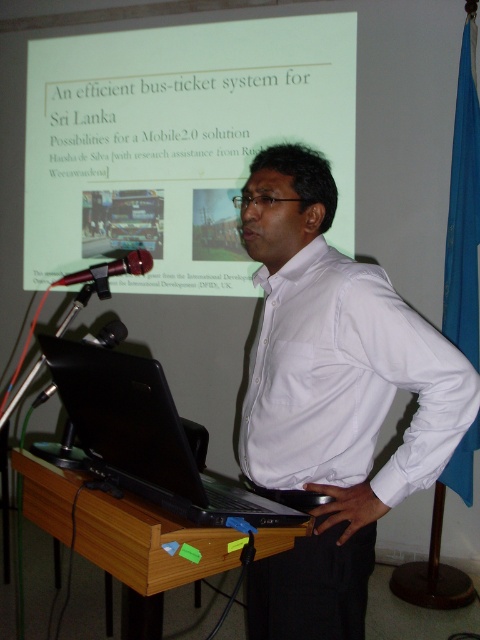
You are a photographer standing behind the podium, and you want to take a photo of the man. The camera you are using has a focal length of 50mm. The minimum distance between the camera and the subject to avoid distortion is 22 inches. Can you take the photo without distortion if you position the camera so that it captures both the white smooth shirt at center and the metallic red microphone at left in the frame?

The white smooth shirt at center and metallic red microphone at left are 21.86 inches apart from each other. Since the minimum distance required to avoid distortion is 22 inches, the camera would need to be slightly further away to ensure both objects are within the safe distance. Therefore, the current setup might result in slight distortion.

Consider the image. You are a photographer setting up for a presentation. You need to ensure that the white smooth shirt at center and the black matte laptop at lower left are both visible in your shot. The minimum distance between them for your camera to focus properly is 30 centimeters. Based on the scene, will your camera be able to focus on both objects?

The distance between the white smooth shirt at center and the black matte laptop at lower left is 29.74 centimeters, which is less than the required 30 centimeters. Therefore, the camera may struggle to focus on both objects simultaneously.